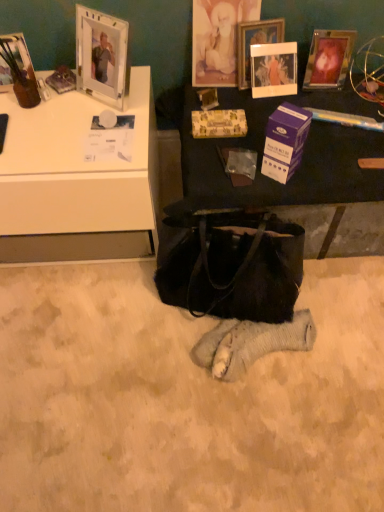
Question: Is matte black table at center bigger or smaller than matte glass picture frame at upper left, placed as the first picture frame when sorted from left to right?

Choices:
 (A) big
 (B) small

Answer: (A)

Question: In terms of height, does matte black table at center look taller or shorter compared to matte glass picture frame at upper left, placed as the first picture frame when sorted from left to right?

Choices:
 (A) tall
 (B) short

Answer: (B)

Question: Which object is the closest to the clear plastic picture frame at upper center, the 3th picture frame viewed from the left?

Choices:
 (A) purple cardboard box at center
 (B) matte black table at center
 (C) gold textured picture frame at upper center, acting as the 3th picture frame starting from the right
 (D) matte glass picture frame at upper left, placed as the first picture frame when sorted from left to right
 (E) metallic silver picture frame at upper right, placed as the first picture frame when sorted from right to left

Answer: (C)

Question: Which is farther from the gold textured picture frame at upper center, acting as the 3th picture frame starting from the right?

Choices:
 (A) gold-patterned paper at center
 (B) metallic silver picture frame at upper right, placed as the first picture frame when sorted from right to left
 (C) purple cardboard box at center
 (D) clear plastic picture frame at upper center, which is the 2th picture frame from right to left
 (E) black leather handbag at center

Answer: (E)